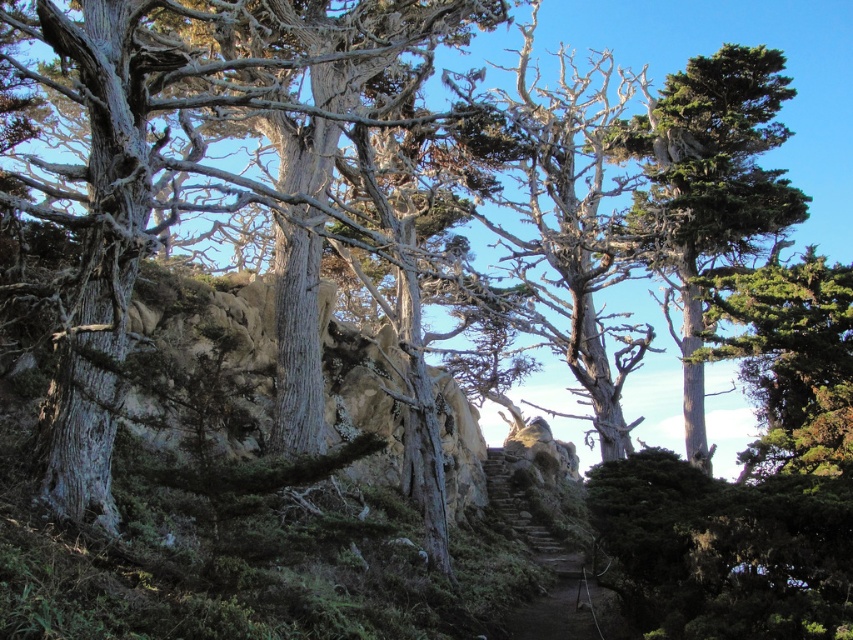
You are a hiker trying to reach the green textured tree at upper right from the brown stone stairs at center. Which direction should you move to get closer to the tree?

You should move forward towards the green textured tree at upper right because it is closer to you than the brown stone stairs at center.

You are standing in the rugged landscape and want to walk from the point at coordinates point (660, 220) to the point at coordinates point (561, 593). Since you can only move forward, will you be moving towards or away from the camera as you walk?

Since point (660, 220) is further to the camera than point (561, 593), you will be moving away from the camera as you walk from point (660, 220) to point (561, 593).

You are standing at the center of the scene and want to locate the green textured tree at upper right. Which cardinal direction should you face to see it?

The green textured tree at upper right is located at point 0.294 on the x axis and 0.829 on the y axis. Since the x coordinate is less than 0.5, it is to the left of the center. The y coordinate is greater than 0.5, meaning it is above the center. Therefore, facing northeast would allow you to see the green textured tree at upper right.